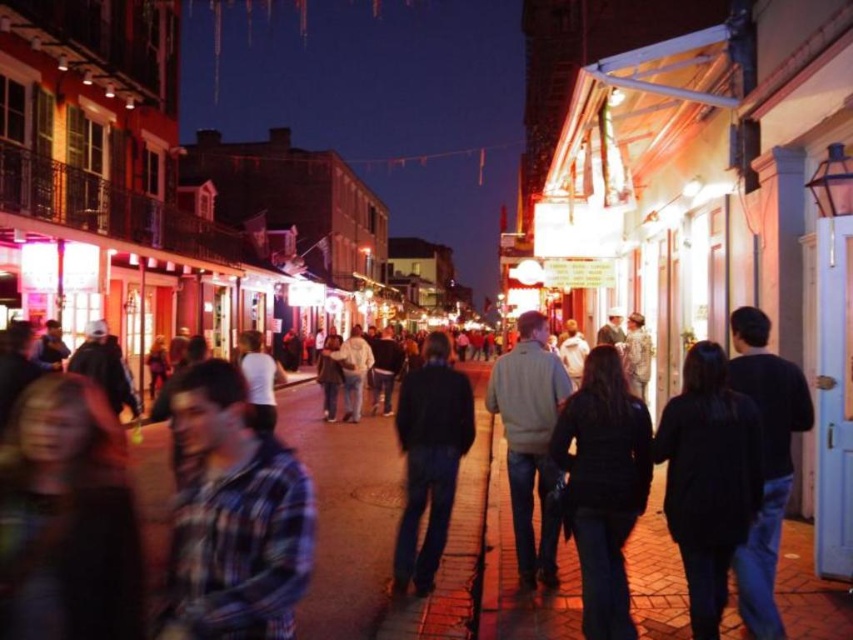
Question: Can you confirm if plaid fabric shirt at center is positioned to the left of dark blue jeans at center?

Choices:
 (A) no
 (B) yes

Answer: (B)

Question: Which point is closer to the camera?

Choices:
 (A) (282, 492)
 (B) (457, 378)

Answer: (A)

Question: Is plaid fabric shirt at center positioned in front of dark blue jeans at center?

Choices:
 (A) yes
 (B) no

Answer: (A)

Question: Can you confirm if plaid fabric shirt at center is positioned to the left of dark blue jeans at center?

Choices:
 (A) no
 (B) yes

Answer: (B)

Question: Which object is closer to the camera taking this photo?

Choices:
 (A) plaid fabric shirt at center
 (B) dark blue jeans at center

Answer: (A)